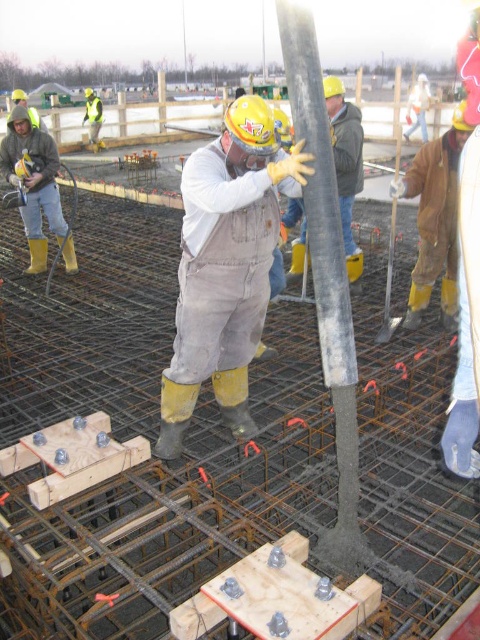
You are an inspector checking the construction site. You notice two poles at the center of the site. Which pole takes up more space, the smooth concrete pole at center or the matte gray pole at center?

The matte gray pole at center occupies more space than the smooth concrete pole at center according to the description.

You are a safety inspector on the construction site. You notice the yellow rubber boots at left and the matte gray pole at center. According to safety regulations, all boots must be placed at least 2 meters away from any poles. Is the current placement compliant with the safety rule?

The yellow rubber boots at left is positioned on the left side of matte gray pole at center. Since the exact distance isn not provided, we cannot confirm compliance with the 2 meter rule. Further measurement is needed.

You are a safety inspector at the construction site. You need to ensure that the yellow rubber boots at left are within a 10 feet safety zone around the matte gray pole at center. Are they within the required distance?

The yellow rubber boots at left is 10.36 feet from matte gray pole at center, which exceeds the 10 feet safety zone requirement. Therefore, the boots are outside the required distance.